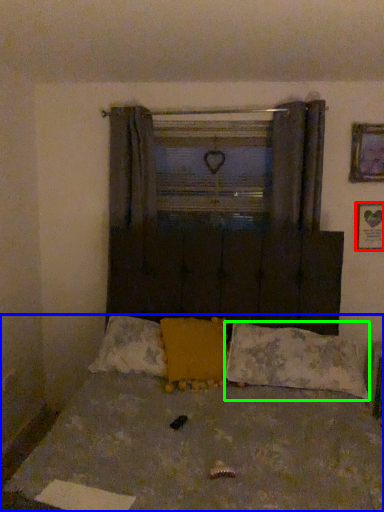
Question: Which object is positioned closest to picture frame (highlighted by a red box)? Select from bed (highlighted by a blue box) and pillow (highlighted by a green box).

Choices:
 (A) bed
 (B) pillow

Answer: (B)